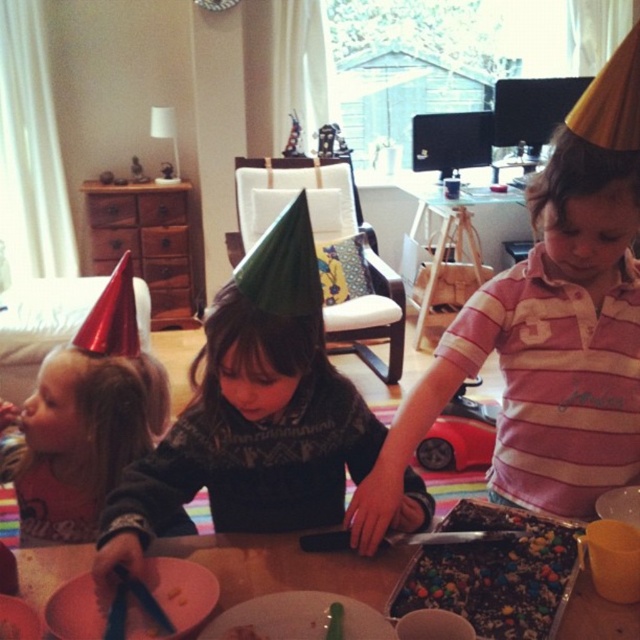
Question: Which object appears closest to the camera in this image?

Choices:
 (A) wooden table at center
 (B) pink striped shirt at center

Answer: (A)

Question: Can you confirm if green felt party hat at center is positioned to the left of chocolate cake with colorful candies at center?

Choices:
 (A) yes
 (B) no

Answer: (A)

Question: Which of the following is the farthest from the observer?

Choices:
 (A) chocolate cake with colorful candies at center
 (B) wooden table at center
 (C) green felt party hat at center
 (D) pink striped shirt at center

Answer: (D)

Question: Which point is closer to the camera?

Choices:
 (A) (234, 554)
 (B) (531, 381)
 (C) (460, 512)
 (D) (403, 513)

Answer: (D)

Question: In this image, where is pink striped shirt at center located relative to green felt party hat at center?

Choices:
 (A) right
 (B) left

Answer: (A)

Question: Does green felt party hat at center appear under chocolate cake with colorful candies at center?

Choices:
 (A) no
 (B) yes

Answer: (A)